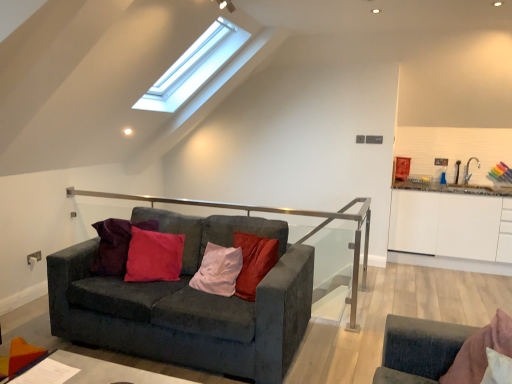
Question: Does velvet dark gray couch at center turn towards white glossy cabinet at right?

Choices:
 (A) no
 (B) yes

Answer: (A)

Question: Considering the relative sizes of velvet dark gray couch at center and white glossy cabinet at right in the image provided, is velvet dark gray couch at center shorter than white glossy cabinet at right?

Choices:
 (A) yes
 (B) no

Answer: (A)

Question: From a real-world perspective, is velvet dark gray couch at center beneath white glossy cabinet at right?

Choices:
 (A) yes
 (B) no

Answer: (A)

Question: Is velvet dark gray couch at center not close to white glossy cabinet at right?

Choices:
 (A) yes
 (B) no

Answer: (A)

Question: Is velvet dark gray couch at center facing away from white glossy cabinet at right?

Choices:
 (A) yes
 (B) no

Answer: (B)

Question: From the image's perspective, would you say velvet dark gray couch at center is shown under white glossy cabinet at right?

Choices:
 (A) yes
 (B) no

Answer: (A)

Question: Could white glossy cabinet at right be considered to be inside smooth gray table at lower left?

Choices:
 (A) yes
 (B) no

Answer: (B)

Question: Is smooth gray table at lower left positioned with its back to white glossy cabinet at right?

Choices:
 (A) no
 (B) yes

Answer: (A)

Question: Considering the relative sizes of smooth gray table at lower left and white glossy cabinet at right in the image provided, is smooth gray table at lower left shorter than white glossy cabinet at right?

Choices:
 (A) no
 (B) yes

Answer: (B)

Question: Are smooth gray table at lower left and white glossy cabinet at right making contact?

Choices:
 (A) no
 (B) yes

Answer: (A)

Question: Would you consider smooth gray table at lower left to be distant from white glossy cabinet at right?

Choices:
 (A) yes
 (B) no

Answer: (A)

Question: Considering the relative positions of smooth gray table at lower left and white glossy cabinet at right in the image provided, is smooth gray table at lower left to the right of white glossy cabinet at right from the viewer's perspective?

Choices:
 (A) yes
 (B) no

Answer: (B)

Question: Does smooth gray table at lower left lie behind velvet dark gray couch at center?

Choices:
 (A) no
 (B) yes

Answer: (A)